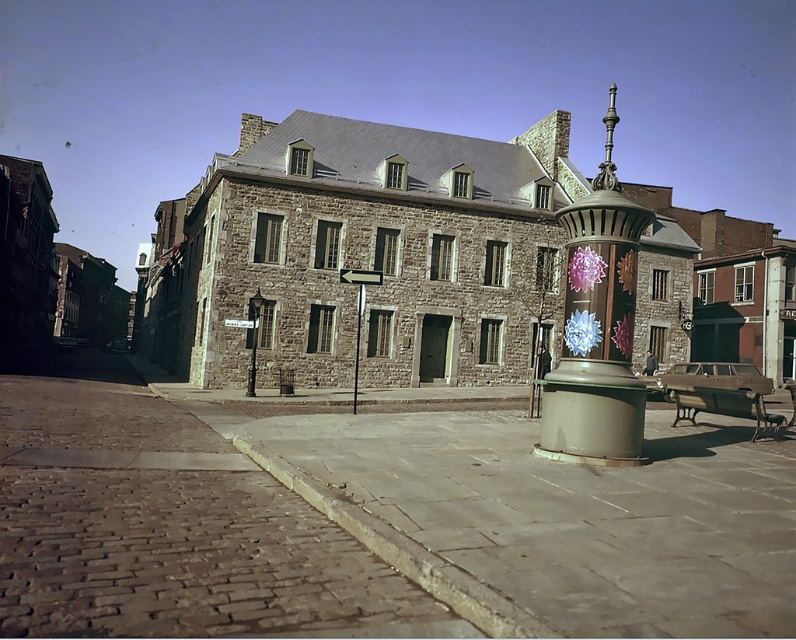
Does brown cobblestone pavement at lower left have a lesser width compared to metallic gold trash can at center?

Correct, brown cobblestone pavement at lower left's width is less than metallic gold trash can at center's.

Who is more forward, (147,520) or (619,364)?

Point (147,520)

Identify the location of brown cobblestone pavement at lower left. The height and width of the screenshot is (640, 796). (170, 531).

Which is in front, point (642, 493) or point (263, 579)?

Point (263, 579)

Locate an element on the screen. The width and height of the screenshot is (796, 640). smooth concrete pavement at center is located at coordinates (560, 518).

Does smooth concrete pavement at center have a smaller size compared to metallic gold trash can at center?

Yes.

Can you confirm if smooth concrete pavement at center is positioned to the left of metallic gold trash can at center?

Indeed, smooth concrete pavement at center is positioned on the left side of metallic gold trash can at center.

Where is `smooth concrete pavement at center`? smooth concrete pavement at center is located at coordinates (560, 518).